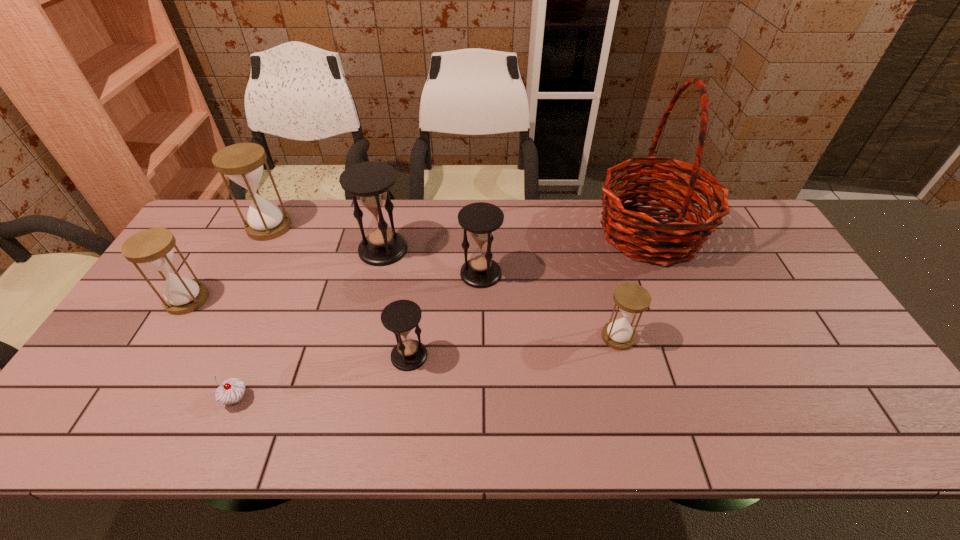
What are the coordinates of `the tallest object` in the screenshot? It's located at (672, 238).

Where is `the biggest black hourglass`? This screenshot has width=960, height=540. the biggest black hourglass is located at coordinates (370, 181).

Identify the location of the leftmost black hourglass. (370, 181).

Find the location of `the biggest white hourglass`. the biggest white hourglass is located at coordinates (243, 163).

The image size is (960, 540). Identify the location of the sixth object from left to right. (480, 219).

I want to click on the second smallest black hourglass, so click(x=480, y=219).

What are the coordinates of `the second smallest white hourglass` in the screenshot? It's located at (153, 248).

Find the location of a particular element. the smallest white hourglass is located at coordinates (630, 298).

The image size is (960, 540). I want to click on the rightmost hourglass, so click(x=630, y=298).

At what (x,y) coordinates should I click in order to perform the action: click on the nearest black hourglass. Please return your answer as a coordinate pair (x, y). Looking at the image, I should click on (400, 317).